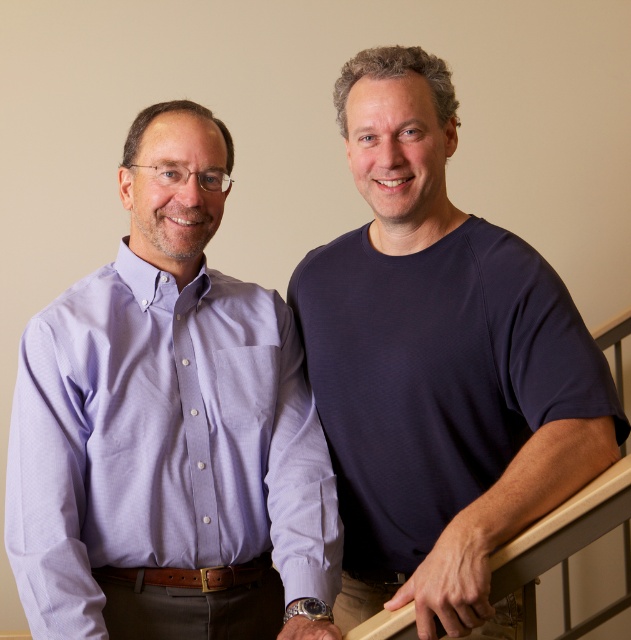
Question: Which object appears closest to the camera in this image?

Choices:
 (A) lavender cotton shirt at left
 (B) dark blue t-shirt at upper right

Answer: (B)

Question: Is lavender cotton shirt at left below dark blue t-shirt at upper right?

Choices:
 (A) no
 (B) yes

Answer: (B)

Question: Which point is closer to the camera?

Choices:
 (A) (387, 390)
 (B) (141, 470)

Answer: (B)

Question: Can you confirm if lavender cotton shirt at left is positioned below dark blue t-shirt at upper right?

Choices:
 (A) yes
 (B) no

Answer: (A)

Question: In this image, where is lavender cotton shirt at left located relative to dark blue t-shirt at upper right?

Choices:
 (A) right
 (B) left

Answer: (B)